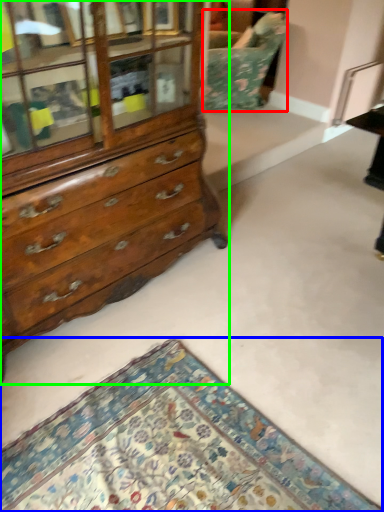
Question: Which object is the closest to the swivel chair (highlighted by a red box)? Choose among these: mat (highlighted by a blue box) or chest of drawers (highlighted by a green box).

Choices:
 (A) mat
 (B) chest of drawers

Answer: (B)